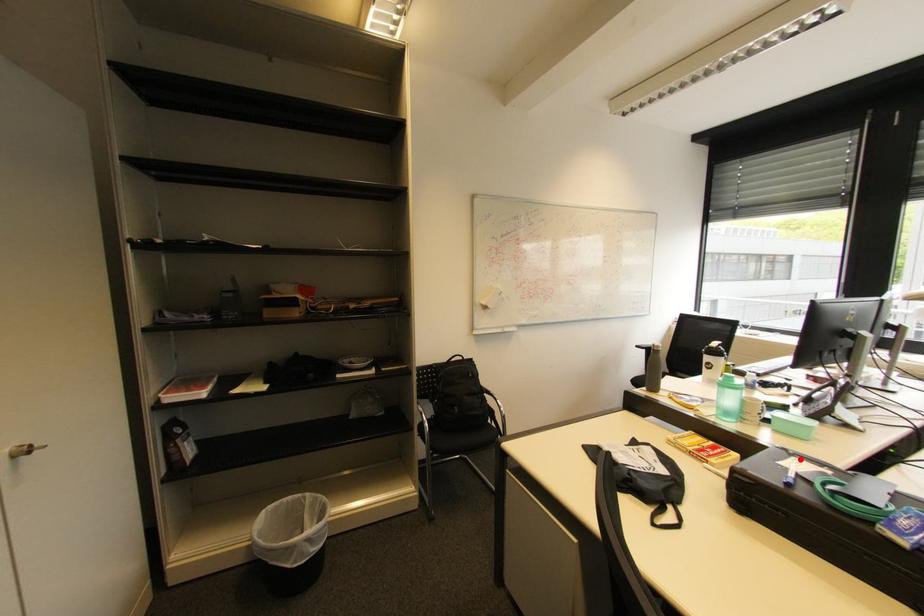
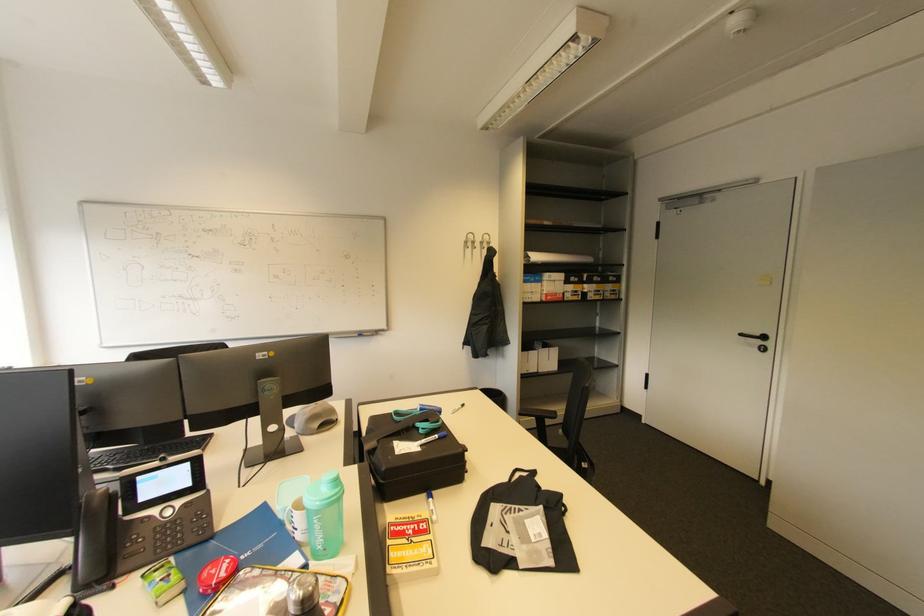
The point at the highlighted location is marked in the first image. Where is the corresponding point in the second image?

(402, 455)